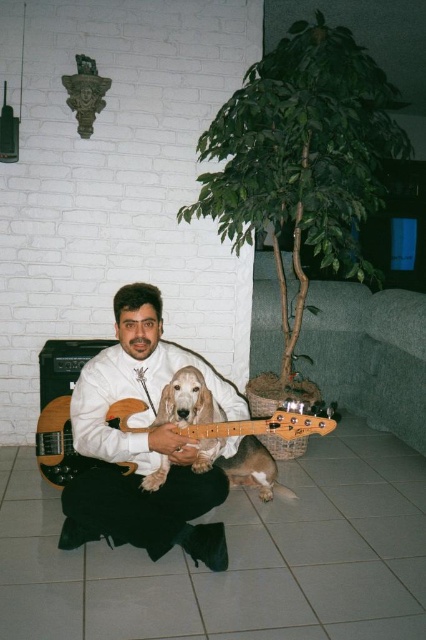
Question: Which point appears farthest from the camera in this image?

Choices:
 (A) (377, 145)
 (B) (69, 470)
 (C) (259, 465)
 (D) (57, 419)

Answer: (A)

Question: Is green leafy tree at center smaller than wooden electric guitar at lower left?

Choices:
 (A) no
 (B) yes

Answer: (A)

Question: Which object is positioned closest to the wooden electric guitar at center?

Choices:
 (A) white matte shirt at center
 (B) light brown fur dog at center
 (C) wooden electric guitar at lower left
 (D) green leafy tree at center

Answer: (C)

Question: Which point is closer to the camera?

Choices:
 (A) (216, 451)
 (B) (45, 472)
 (C) (51, 436)
 (D) (209, 140)

Answer: (A)

Question: From the image, what is the correct spatial relationship of light brown fur dog at center in relation to wooden electric guitar at lower left?

Choices:
 (A) right
 (B) left

Answer: (A)

Question: Does green leafy tree at center have a lesser width compared to light brown fur dog at center?

Choices:
 (A) yes
 (B) no

Answer: (B)